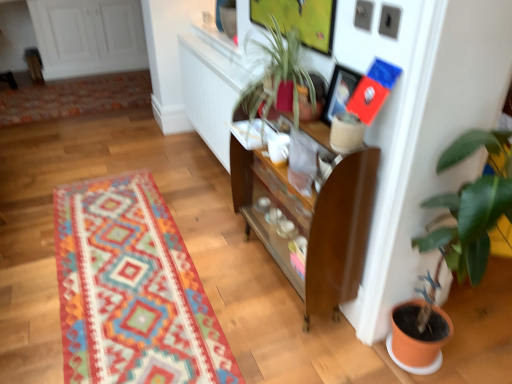
Describe the element at coordinates (73, 96) in the screenshot. I see `multicolored woven rug at upper left, placed as the first mat when sorted from back to front` at that location.

Image resolution: width=512 pixels, height=384 pixels. What do you see at coordinates (312, 221) in the screenshot?
I see `brown wood cabinet at center` at bounding box center [312, 221].

What do you see at coordinates (278, 148) in the screenshot?
I see `white glossy coffee cup at center` at bounding box center [278, 148].

You are a GUI agent. You are given a task and a screenshot of the screen. Output one action in this format:
    pyautogui.click(x=<x>, y=<y>)
    Task: Click on the multicolored woven rug at upper left, the 2th mat in the front-to-back sequence
    This screenshot has height=384, width=512.
    Given the screenshot: What is the action you would take?
    pyautogui.click(x=73, y=96)

Which of these two, green glossy plant at right or multicolored woven rug at center, positioned as the 1th mat in bottom-to-top order, is thinner?

green glossy plant at right.

Which of these two, green glossy plant at right or multicolored woven rug at center, which appears as the second mat when viewed from the back, stands taller?

With more height is green glossy plant at right.

Are green glossy plant at right and multicolored woven rug at center, which ranks as the first mat in front-to-back order, making contact?

No, green glossy plant at right is not in contact with multicolored woven rug at center, which ranks as the first mat in front-to-back order.

Locate an element on the screen. The height and width of the screenshot is (384, 512). mat that is below the green glossy plant at right (from the image's perspective) is located at coordinates (132, 290).

From a real-world perspective, is green glossy plant at right positioned above or below white glossy coffee cup at center?

Clearly, from a real-world perspective, green glossy plant at right is below white glossy coffee cup at center.

Who is smaller, green glossy plant at right or white glossy coffee cup at center?

With smaller size is white glossy coffee cup at center.

How distant is green glossy plant at right from white glossy coffee cup at center?

green glossy plant at right is 25.77 inches away from white glossy coffee cup at center.

Does green glossy plant at right have a lesser width compared to white glossy coffee cup at center?

No.

Does matte black picture frame at upper center lie behind white glossy coffee cup at center?

No, it is not.

Considering the sizes of objects matte black picture frame at upper center and white glossy coffee cup at center in the image provided, who is shorter, matte black picture frame at upper center or white glossy coffee cup at center?

Standing shorter between the two is white glossy coffee cup at center.

Is matte black picture frame at upper center far away from white glossy coffee cup at center?

No, matte black picture frame at upper center is not far from white glossy coffee cup at center.

From the image's perspective, is matte black picture frame at upper center beneath brown wood cabinet at center?

Incorrect, from the image's perspective, matte black picture frame at upper center is higher than brown wood cabinet at center.

Considering the positions of point (352, 84) and point (290, 190), is point (352, 84) closer or farther from the camera than point (290, 190)?

Point (352, 84) is positioned closer to the camera compared to point (290, 190).

Based on their positions, is matte black picture frame at upper center located to the left or right of brown wood cabinet at center?

Clearly, matte black picture frame at upper center is on the right of brown wood cabinet at center in the image.

Considering the relative sizes of green glossy plant at right and brown wood cabinet at center in the image provided, is green glossy plant at right wider than brown wood cabinet at center?

Correct, the width of green glossy plant at right exceeds that of brown wood cabinet at center.

Are green glossy plant at right and brown wood cabinet at center located far from each other?

green glossy plant at right is actually quite close to brown wood cabinet at center.

Does green glossy plant at right lie behind brown wood cabinet at center?

No, green glossy plant at right is closer to the camera.

How distant is green glossy plant at right from brown wood cabinet at center?

green glossy plant at right and brown wood cabinet at center are 16.54 inches apart.

Is white glossy coffee cup at center facing towards matte black picture frame at upper center?

No, white glossy coffee cup at center is not facing towards matte black picture frame at upper center.

Considering the relative positions of white glossy coffee cup at center and matte black picture frame at upper center in the image provided, is white glossy coffee cup at center to the left or to the right of matte black picture frame at upper center?

white glossy coffee cup at center is positioned on matte black picture frame at upper center's left side.

Considering the points (286, 134) and (343, 92), which point is behind, point (286, 134) or point (343, 92)?

Point (286, 134)

This screenshot has height=384, width=512. Identify the location of picture frame lying above the green glossy plant at right (from the image's perspective). (339, 92).

What's the angular difference between green glossy plant at right and matte black picture frame at upper center's facing directions?

94 degrees separate the facing orientations of green glossy plant at right and matte black picture frame at upper center.

Which is in front, green glossy plant at right or matte black picture frame at upper center?

green glossy plant at right is more forward.

Can matte black picture frame at upper center be found inside green glossy plant at right?

Definitely not — matte black picture frame at upper center is not inside green glossy plant at right.

Locate an element on the screen. This screenshot has height=384, width=512. houseplant that is in front of the multicolored woven rug at center, which appears as the second mat when viewed from the back is located at coordinates (454, 248).

Locate an element on the screen. The height and width of the screenshot is (384, 512). houseplant below the white glossy coffee cup at center (from a real-world perspective) is located at coordinates (454, 248).

Based on their spatial positions, is white glossy coffee cup at center or matte black picture frame at upper center further from brown wood cabinet at center?

Among the two, matte black picture frame at upper center is located further to brown wood cabinet at center.

Which object lies further to the anchor point multicolored woven rug at center, positioned as the 1th mat in bottom-to-top order, green glossy plant at right or multicolored woven rug at upper left, placed as the first mat when sorted from back to front?

multicolored woven rug at upper left, placed as the first mat when sorted from back to front, is positioned further to the anchor multicolored woven rug at center, positioned as the 1th mat in bottom-to-top order.

Looking at the image, which one is located closer to brown wood cabinet at center, multicolored woven rug at center, which ranks as the first mat in front-to-back order, or white glossy coffee cup at center?

white glossy coffee cup at center is closer to brown wood cabinet at center.

Consider the image. Based on their spatial positions, is multicolored woven rug at center, which ranks as the first mat in front-to-back order, or matte black picture frame at upper center closer to white glossy coffee cup at center?

Based on the image, matte black picture frame at upper center appears to be nearer to white glossy coffee cup at center.

Which object lies further to the anchor point green glossy plant at right, multicolored woven rug at upper left, marked as the 2th mat in a bottom-to-top arrangement, or multicolored woven rug at center, which ranks as the first mat in front-to-back order?

Based on the image, multicolored woven rug at upper left, marked as the 2th mat in a bottom-to-top arrangement, appears to be further to green glossy plant at right.

In the scene shown: Considering their positions, is green glossy plant at right positioned further to multicolored woven rug at upper left, placed as the first mat when sorted from back to front, than multicolored woven rug at center, positioned as the 1th mat in bottom-to-top order?

green glossy plant at right lies further to multicolored woven rug at upper left, placed as the first mat when sorted from back to front, than the other object.

When comparing their distances from matte black picture frame at upper center, does white glossy coffee cup at center or green glossy plant at right seem further?

green glossy plant at right is further to matte black picture frame at upper center.

From the image, which object appears to be farther from multicolored woven rug at center, which ranks as the first mat in front-to-back order, white glossy coffee cup at center or matte black picture frame at upper center?

matte black picture frame at upper center lies further to multicolored woven rug at center, which ranks as the first mat in front-to-back order, than the other object.

Identify the location of picture frame between multicolored woven rug at center, which ranks as the first mat in front-to-back order, and green glossy plant at right. (339, 92).

Image resolution: width=512 pixels, height=384 pixels. Find the location of `cabinetry between green glossy plant at right and matte black picture frame at upper center along the z-axis`. cabinetry between green glossy plant at right and matte black picture frame at upper center along the z-axis is located at coordinates (312, 221).

I want to click on coffee cup between multicolored woven rug at center, the 2th mat in the top-to-bottom sequence, and multicolored woven rug at upper left, which is the 1th mat in top-to-bottom order, from front to back, so click(x=278, y=148).

You are a GUI agent. You are given a task and a screenshot of the screen. Output one action in this format:
    pyautogui.click(x=<x>, y=<y>)
    Task: Click on the cabinetry between multicolored woven rug at upper left, marked as the 2th mat in a bottom-to-top arrangement, and matte black picture frame at upper center from left to right
    The image size is (512, 384).
    Given the screenshot: What is the action you would take?
    pyautogui.click(x=312, y=221)